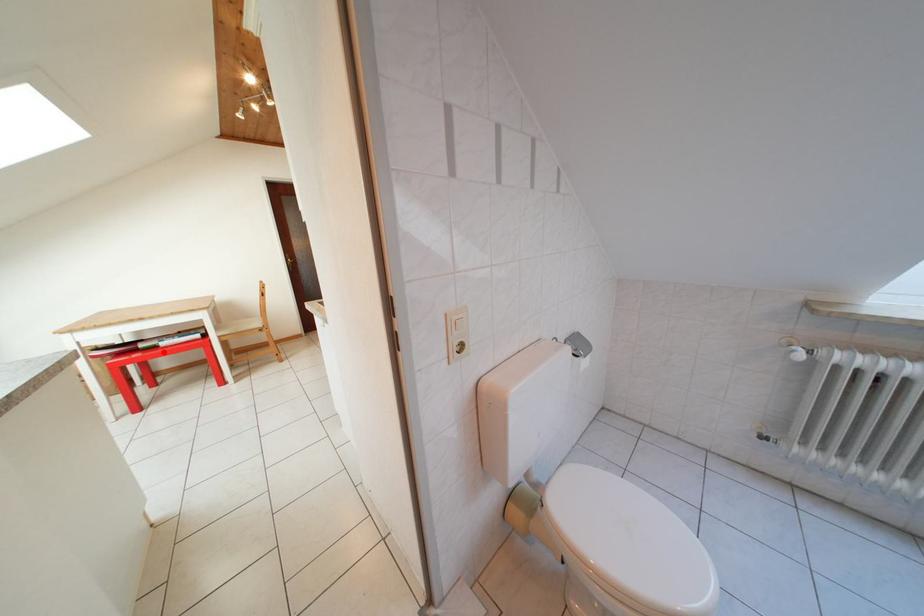
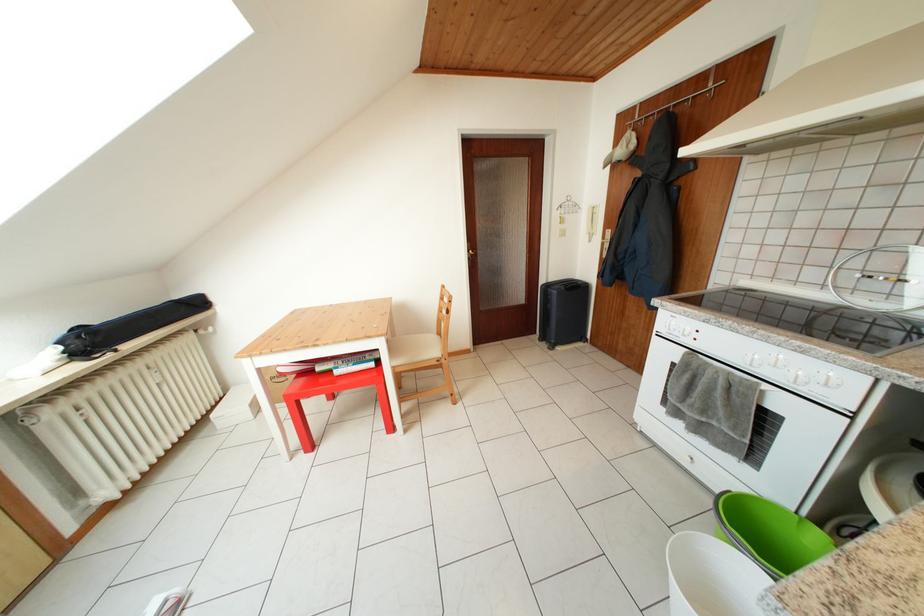
In the second image, find the point that corresponds to the highlighted location in the first image.

(338, 377)